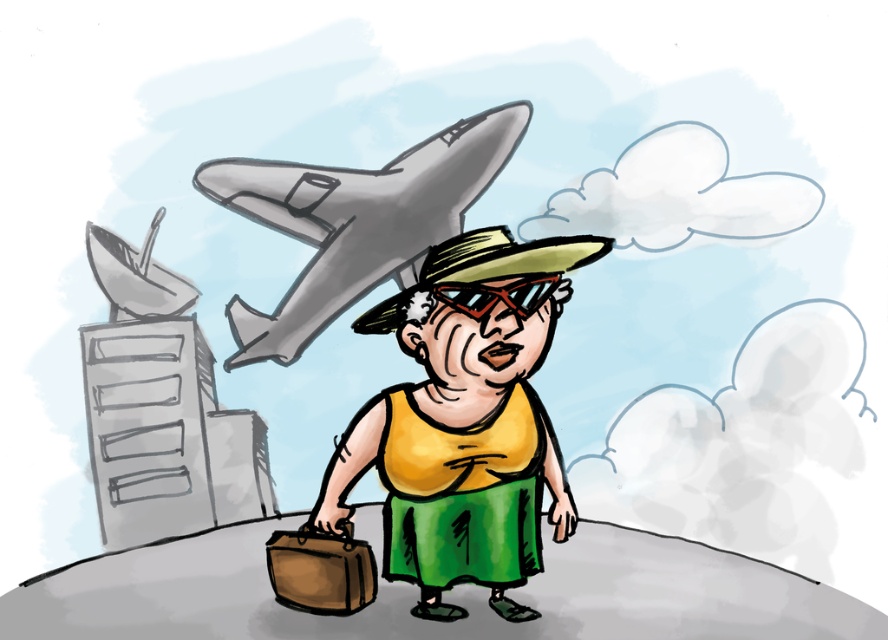
Between yellow fabric shirt at center and matte black goggles at center, which one is positioned higher?

matte black goggles at center is higher up.

Consider the image. Can you confirm if yellow fabric shirt at center is thinner than matte black goggles at center?

No, yellow fabric shirt at center is not thinner than matte black goggles at center.

Between point (435, 424) and point (482, 314), which one is positioned behind?

Positioned behind is point (435, 424).

Locate an element on the screen. This screenshot has height=640, width=888. yellow fabric shirt at center is located at coordinates (464, 420).

Does brown leather suitcase at lower center have a lesser width compared to matte black goggles at center?

Correct, brown leather suitcase at lower center's width is less than matte black goggles at center's.

The height and width of the screenshot is (640, 888). What do you see at coordinates (321, 570) in the screenshot?
I see `brown leather suitcase at lower center` at bounding box center [321, 570].

The width and height of the screenshot is (888, 640). In order to click on brown leather suitcase at lower center in this screenshot , I will do `click(321, 570)`.

Is yellow fabric shirt at center to the right of brown leather suitcase at lower center from the viewer's perspective?

Yes, yellow fabric shirt at center is to the right of brown leather suitcase at lower center.

Can you confirm if yellow fabric shirt at center is wider than brown leather suitcase at lower center?

Correct, the width of yellow fabric shirt at center exceeds that of brown leather suitcase at lower center.

What do you see at coordinates (464, 420) in the screenshot?
I see `yellow fabric shirt at center` at bounding box center [464, 420].

The height and width of the screenshot is (640, 888). In order to click on yellow fabric shirt at center in this screenshot , I will do `click(464, 420)`.